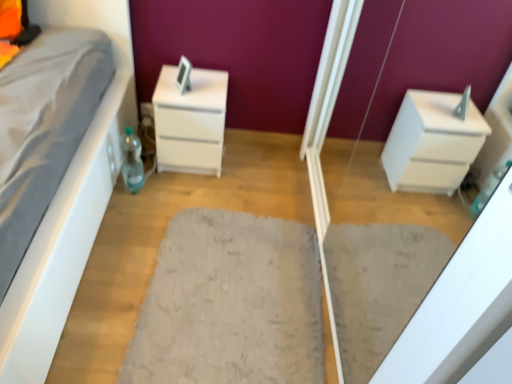
Where is `free region under gray fluffy rug at center (from a real-world perspective)`? The width and height of the screenshot is (512, 384). free region under gray fluffy rug at center (from a real-world perspective) is located at coordinates [241, 299].